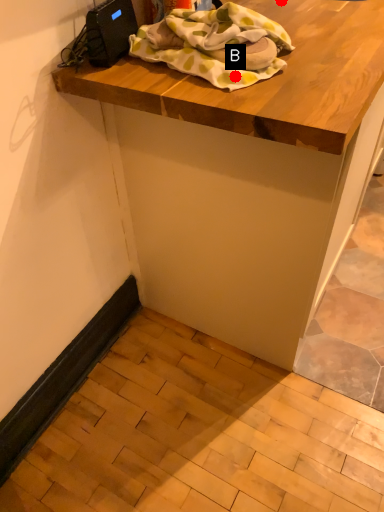
Question: Two points are circled on the image, labeled by A and B beside each circle. Which point appears closest to the camera in this image?

Choices:
 (A) A is closer
 (B) B is closer

Answer: (B)